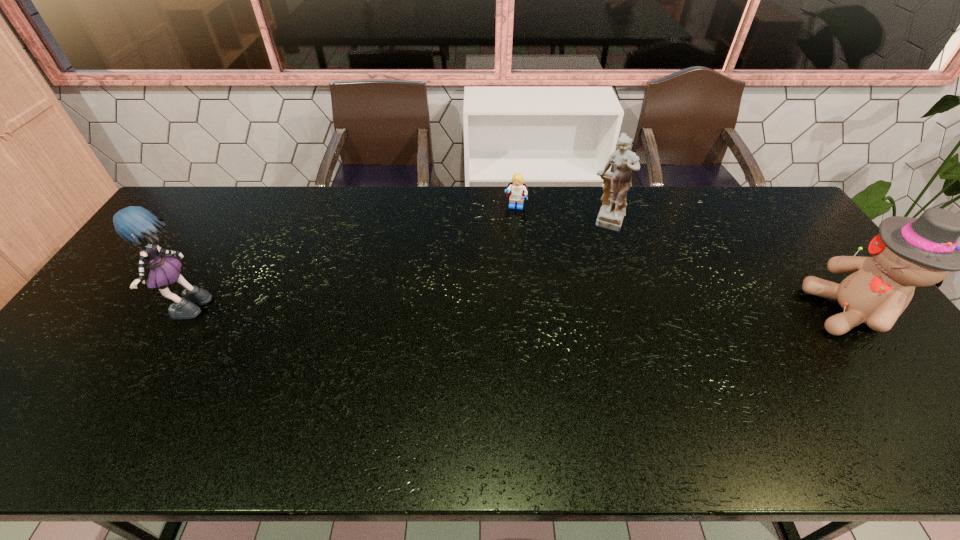
Identify the location of vacant spot on the desktop that is between the leftmost object and the rightmost object and is positioned on the front-facing side of the second object from left to right. The image size is (960, 540). (495, 312).

Find the location of `vacant space on the desktop that is between the left rag_doll and the right rag_doll and is positioned on the front-facing side of the figurine`. vacant space on the desktop that is between the left rag_doll and the right rag_doll and is positioned on the front-facing side of the figurine is located at coordinates (589, 312).